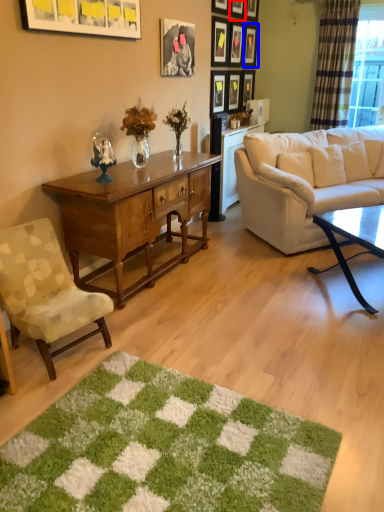
Question: Which of the following is the closest to the observer, picture frame (highlighted by a red box) or picture frame (highlighted by a blue box)?

Choices:
 (A) picture frame
 (B) picture frame

Answer: (A)